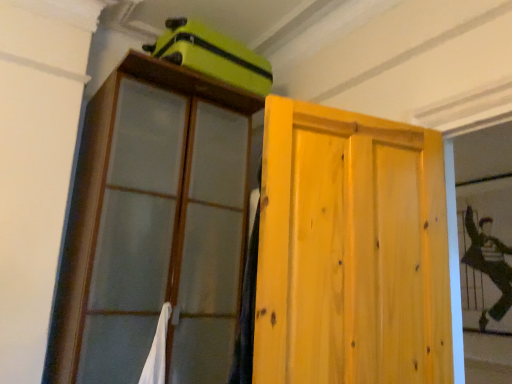
The width and height of the screenshot is (512, 384). Find the location of `silky black fabric at right`. silky black fabric at right is located at coordinates (489, 264).

Measure the distance between point (370, 363) and camera.

They are 1.41 meters apart.

Find the location of a particular element. wooden cabinet at upper left is located at coordinates (153, 226).

In the image, is light wood door at center on the left side or the right side of silky black fabric at right?

From the image, it's evident that light wood door at center is to the left of silky black fabric at right.

From a real-world perspective, who is located higher, light wood door at center or silky black fabric at right?

In real-world perspective, silky black fabric at right is above.

Which is behind, point (441, 189) or point (492, 270)?

The point (492, 270) is farther.

Measure the distance from light wood door at center to matte green suitcase at upper center.

light wood door at center and matte green suitcase at upper center are 3.49 feet apart from each other.

Where is `door below the matte green suitcase at upper center (from the image's perspective)`? door below the matte green suitcase at upper center (from the image's perspective) is located at coordinates (351, 250).

From the image's perspective, is light wood door at center above matte green suitcase at upper center?

No, from the image's perspective, light wood door at center is not over matte green suitcase at upper center.

Looking at this image, is light wood door at center turned away from matte green suitcase at upper center?

No, light wood door at center is not facing away from matte green suitcase at upper center.

From a real-world perspective, who is located lower, matte green suitcase at upper center or silky black fabric at right?

silky black fabric at right, from a real-world perspective.

Which object is wider, matte green suitcase at upper center or silky black fabric at right?

matte green suitcase at upper center is wider.

Considering the relative sizes of matte green suitcase at upper center and silky black fabric at right in the image provided, is matte green suitcase at upper center smaller than silky black fabric at right?

Incorrect, matte green suitcase at upper center is not smaller in size than silky black fabric at right.

The height and width of the screenshot is (384, 512). Find the location of `couple below the matte green suitcase at upper center (from the image's perspective)`. couple below the matte green suitcase at upper center (from the image's perspective) is located at coordinates (489, 264).

From their relative heights in the image, would you say light wood door at center is taller or shorter than wooden cabinet at upper left?

Considering their sizes, light wood door at center has less height than wooden cabinet at upper left.

Find the location of a particular element. This screenshot has width=512, height=384. cupboard lying on the left of light wood door at center is located at coordinates (153, 226).

Looking at this image, how distant is light wood door at center from wooden cabinet at upper left?

light wood door at center and wooden cabinet at upper left are 37.21 inches apart from each other.

From a real-world perspective, is light wood door at center physically located above or below wooden cabinet at upper left?

In terms of real-world spatial position, light wood door at center is below wooden cabinet at upper left.

Considering the positions of point (467, 231) and point (211, 29), is point (467, 231) closer or farther from the camera than point (211, 29)?

Clearly, point (467, 231) is more distant from the camera than point (211, 29).

Would you consider silky black fabric at right to be distant from matte green suitcase at upper center?

Yes, silky black fabric at right and matte green suitcase at upper center are located far from each other.

Based on the photo, what's the angular difference between silky black fabric at right and matte green suitcase at upper center's facing directions?

They differ by 90.9 degrees in their facing directions.

Is matte green suitcase at upper center wider than wooden cabinet at upper left?

No.

Measure the distance from matte green suitcase at upper center to wooden cabinet at upper left.

matte green suitcase at upper center is 22.98 inches away from wooden cabinet at upper left.

Considering the sizes of objects matte green suitcase at upper center and wooden cabinet at upper left in the image provided, who is shorter, matte green suitcase at upper center or wooden cabinet at upper left?

With less height is matte green suitcase at upper center.

From the image's perspective, between matte green suitcase at upper center and wooden cabinet at upper left, who is located below?

wooden cabinet at upper left.

From the image's perspective, who appears lower, silky black fabric at right or light wood door at center?

From the image's view, silky black fabric at right is below.

Is silky black fabric at right in contact with light wood door at center?

They are not placed beside each other.

Is silky black fabric at right oriented towards light wood door at center?

Yes, silky black fabric at right is facing light wood door at center.

Where is `couple behind the light wood door at center`? This screenshot has width=512, height=384. couple behind the light wood door at center is located at coordinates (489, 264).

I want to click on couple that appears on the right of light wood door at center, so click(x=489, y=264).

Identify the location of door in front of the matte green suitcase at upper center. The width and height of the screenshot is (512, 384). tap(351, 250).

Looking at the image, which one is located further to light wood door at center, matte green suitcase at upper center or silky black fabric at right?

silky black fabric at right lies further to light wood door at center than the other object.

Estimate the real-world distances between objects in this image. Which object is closer to silky black fabric at right, light wood door at center or wooden cabinet at upper left?

light wood door at center lies closer to silky black fabric at right than the other object.

Based on their spatial positions, is wooden cabinet at upper left or silky black fabric at right closer to light wood door at center?

wooden cabinet at upper left.

Estimate the real-world distances between objects in this image. Which object is closer to matte green suitcase at upper center, silky black fabric at right or wooden cabinet at upper left?

The object closer to matte green suitcase at upper center is wooden cabinet at upper left.

Considering their positions, is silky black fabric at right positioned further to light wood door at center than matte green suitcase at upper center?

silky black fabric at right is further to light wood door at center.

Based on their spatial positions, is light wood door at center or wooden cabinet at upper left closer to matte green suitcase at upper center?

Based on the image, wooden cabinet at upper left appears to be nearer to matte green suitcase at upper center.

Estimate the real-world distances between objects in this image. Which object is further from silky black fabric at right, matte green suitcase at upper center or light wood door at center?

matte green suitcase at upper center is positioned further to the anchor silky black fabric at right.

Looking at the image, which one is located closer to wooden cabinet at upper left, silky black fabric at right or matte green suitcase at upper center?

matte green suitcase at upper center lies closer to wooden cabinet at upper left than the other object.

Locate an element on the screen. The image size is (512, 384). door located between matte green suitcase at upper center and silky black fabric at right in the left-right direction is located at coordinates (351, 250).

At what (x,y) coordinates should I click in order to perform the action: click on door between matte green suitcase at upper center and wooden cabinet at upper left vertically. Please return your answer as a coordinate pair (x, y). Looking at the image, I should click on (351, 250).

The image size is (512, 384). I want to click on door between wooden cabinet at upper left and silky black fabric at right in the horizontal direction, so click(351, 250).

Find the location of `luggage situated between wooden cabinet at upper left and silky black fabric at right from left to right`. luggage situated between wooden cabinet at upper left and silky black fabric at right from left to right is located at coordinates (212, 55).